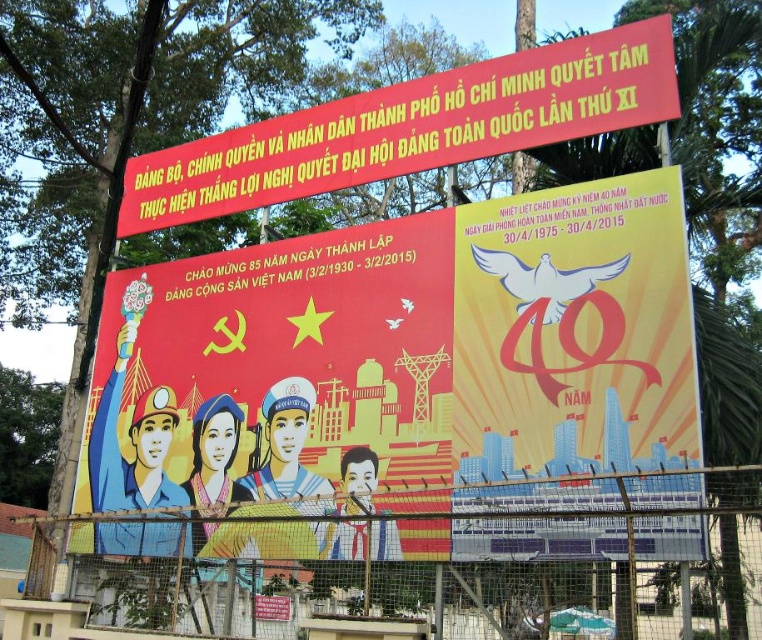
Does matte red poster at center lie behind metal wire mesh at lower center?

Yes.

Which is more to the left, matte red poster at center or metal wire mesh at lower center?

matte red poster at center

Where is `matte red poster at center`? This screenshot has height=640, width=762. matte red poster at center is located at coordinates (277, 372).

Where is `matte red poster at center`? This screenshot has width=762, height=640. matte red poster at center is located at coordinates (277, 372).

Who is lower down, yellow paper poster at center or metal wire mesh at lower center?

metal wire mesh at lower center is below.

At what (x,y) coordinates should I click in order to perform the action: click on yellow paper poster at center. Please return your answer as a coordinate pair (x, y). Looking at the image, I should click on (572, 342).

Which of these two, yellow paper poster at center or red banner at upper center, stands shorter?

With less height is red banner at upper center.

Who is lower down, yellow paper poster at center or red banner at upper center?

yellow paper poster at center is below.

The height and width of the screenshot is (640, 762). Find the location of `yellow paper poster at center`. yellow paper poster at center is located at coordinates click(572, 342).